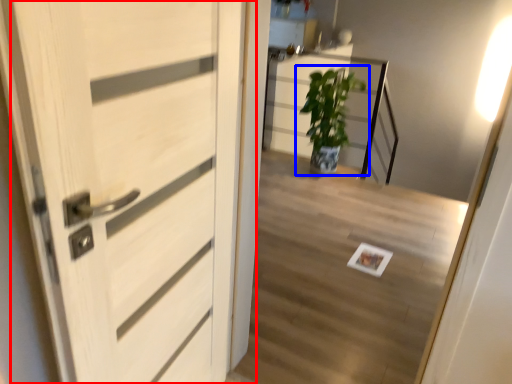
Question: Which point is further to the camera, door (highlighted by a red box) or houseplant (highlighted by a blue box)?

Choices:
 (A) door
 (B) houseplant

Answer: (B)